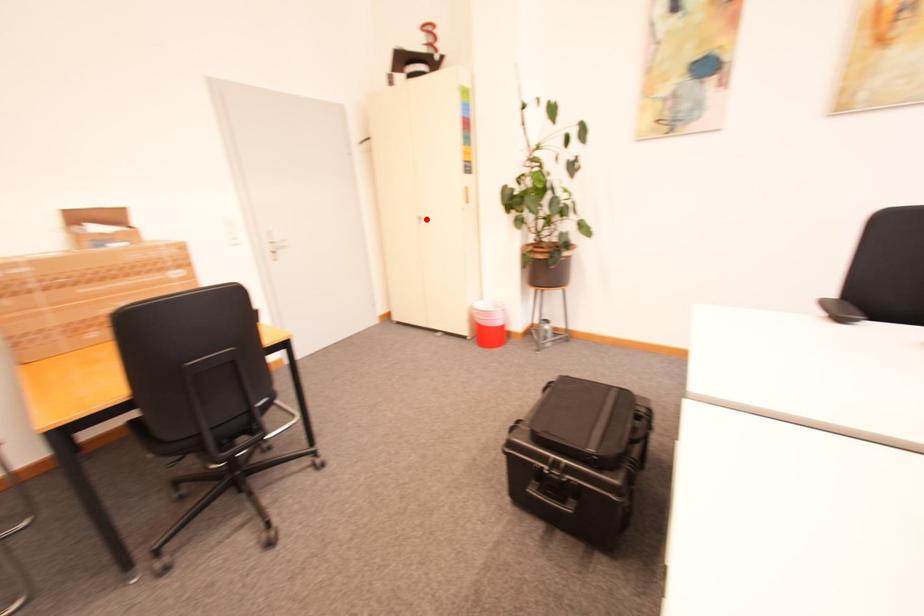
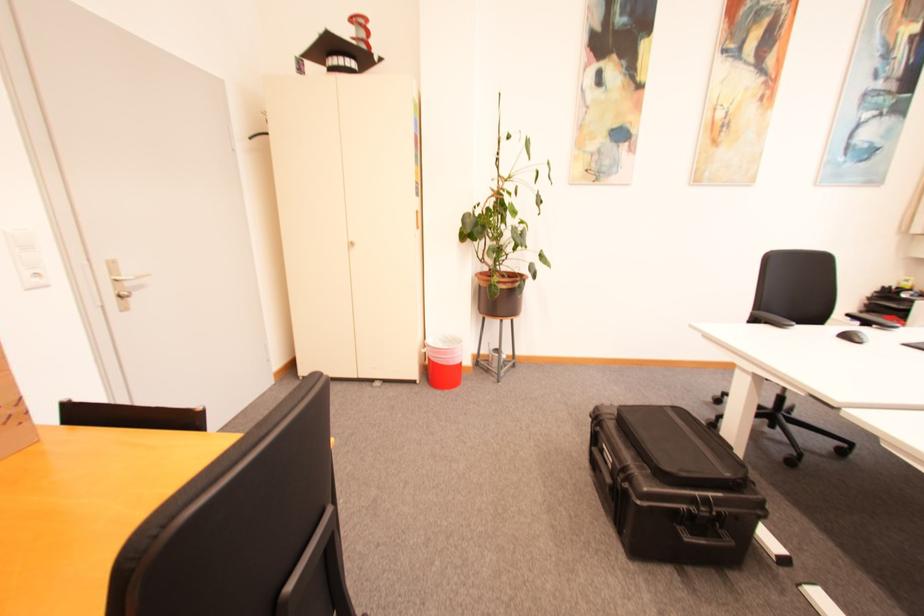
Where in the second image is the point corresponding to the highlighted location from the first image?

(359, 245)